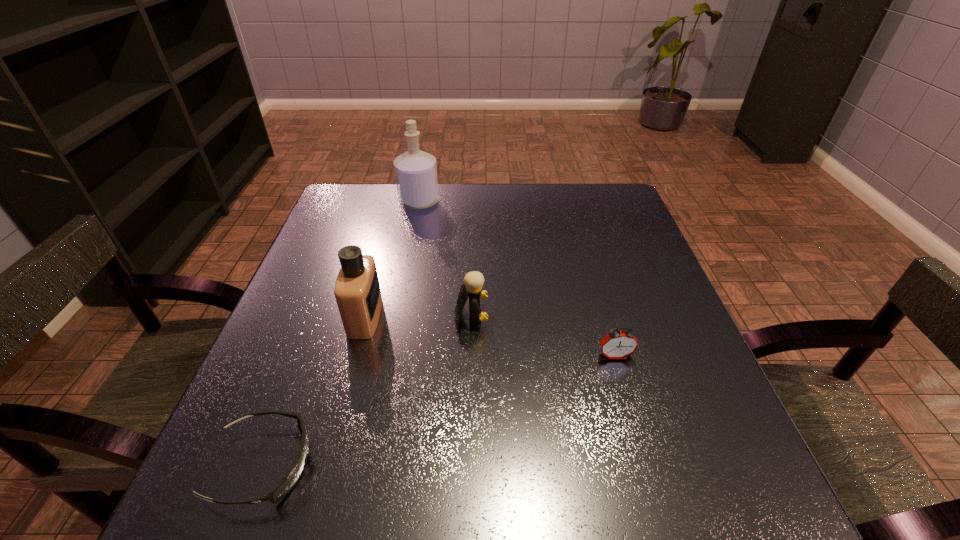
Locate an element on the screen. The width and height of the screenshot is (960, 540). object situated at the near left corner is located at coordinates (293, 475).

What are the coordinates of `free location at the far edge` in the screenshot? It's located at (484, 212).

This screenshot has height=540, width=960. In order to click on vacant space at the near edge of the desktop in this screenshot , I will do `click(611, 482)`.

In order to click on vacant space at the left edge in this screenshot , I will do `click(348, 233)`.

The image size is (960, 540). In order to click on free point at the right edge in this screenshot , I will do `click(590, 250)`.

Find the location of a particular element. free space at the far left corner is located at coordinates (381, 196).

Image resolution: width=960 pixels, height=540 pixels. In order to click on free space between the taller perfume and the second tallest object in this screenshot , I will do `click(392, 259)`.

This screenshot has width=960, height=540. In order to click on free area in between the shorter perfume and the goggles in this screenshot , I will do `click(314, 391)`.

Identify the location of unoccupied position between the Lego and the rightmost object. (543, 336).

I want to click on empty location between the alarm clock and the second object from right to left, so click(543, 336).